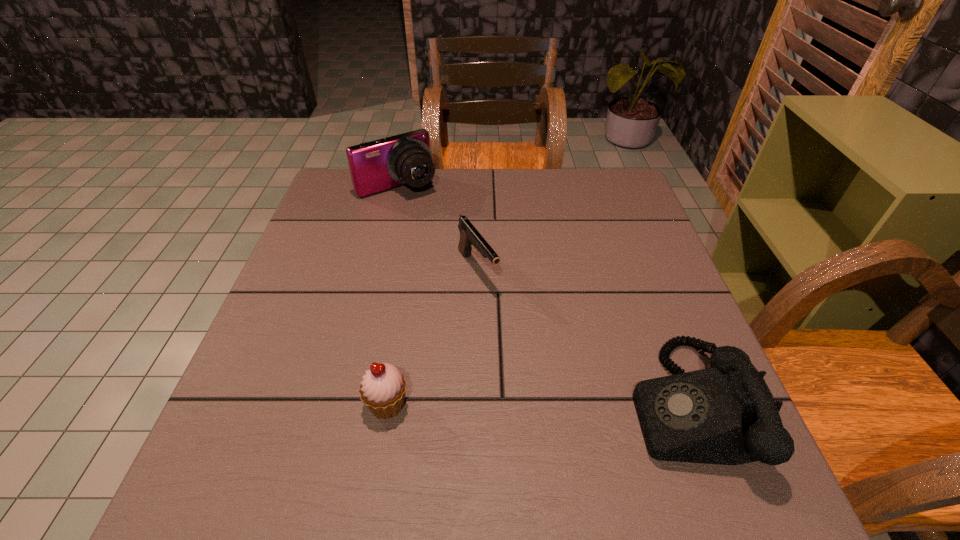
In order to click on blank area in the image that satisfies the following two spatial constraints: 1. on the front side of the cupcake; 2. on the left side of the farthest object in this screenshot , I will do `click(346, 404)`.

Locate an element on the screen. The width and height of the screenshot is (960, 540). blank area in the image that satisfies the following two spatial constraints: 1. on the front side of the farthest object; 2. on the dial of the rightmost object is located at coordinates (346, 404).

Where is `free space that satisfies the following two spatial constraints: 1. on the front side of the farthest object; 2. on the dial of the telephone`? free space that satisfies the following two spatial constraints: 1. on the front side of the farthest object; 2. on the dial of the telephone is located at coordinates (346, 404).